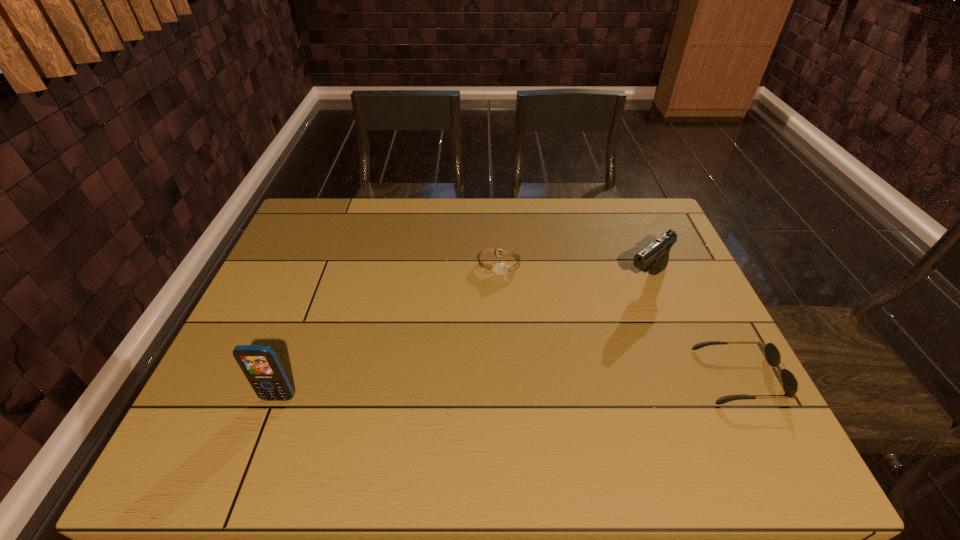
At what (x,y) coordinates should I click in order to perform the action: click on free space on the desktop that is between the leftmost object and the sunglasses and is positioned at the barrel of the pistol. Please return your answer as a coordinate pair (x, y). The height and width of the screenshot is (540, 960). Looking at the image, I should click on (512, 387).

Identify the location of free space on the desktop that is between the cellular telephone and the sunglasses and is positioned on the face of the watch. (468, 389).